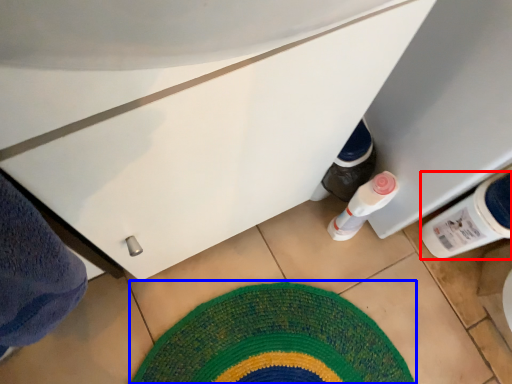
Question: Which object is further to the camera taking this photo, bottle (highlighted by a red box) or mat (highlighted by a blue box)?

Choices:
 (A) bottle
 (B) mat

Answer: (B)